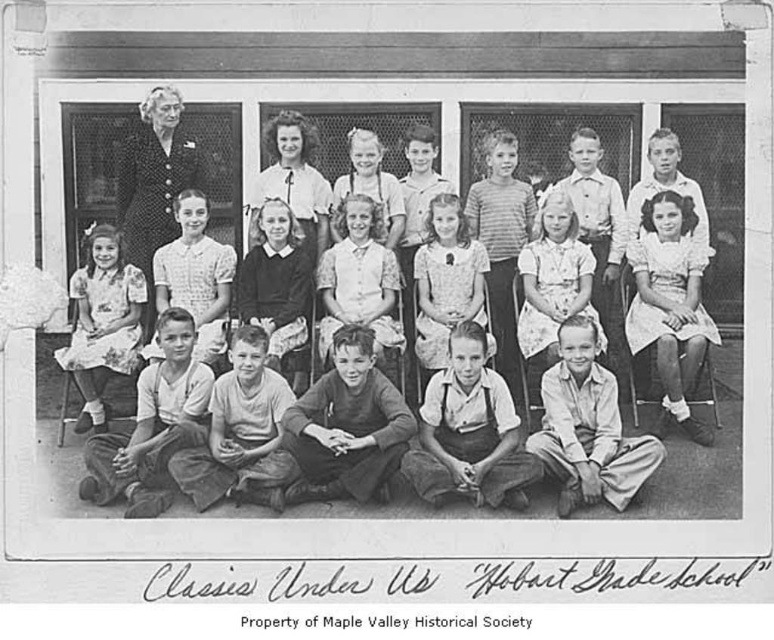
Does light pink dress at center have a larger size compared to dark fabric suit at upper left?

No, light pink dress at center is not bigger than dark fabric suit at upper left.

Identify the location of light pink dress at center. The width and height of the screenshot is (774, 640). (601, 419).

Is floral dress at center taller than dark fabric suit at upper left?

Incorrect, floral dress at center's height is not larger of dark fabric suit at upper left's.

Image resolution: width=774 pixels, height=640 pixels. I want to click on floral dress at center, so click(101, 323).

Is light pink dress at center smaller than floral dress at center?

Indeed, light pink dress at center has a smaller size compared to floral dress at center.

Based on the photo, who is higher up, light pink dress at center or floral dress at center?

floral dress at center

The width and height of the screenshot is (774, 640). I want to click on light pink dress at center, so click(x=601, y=419).